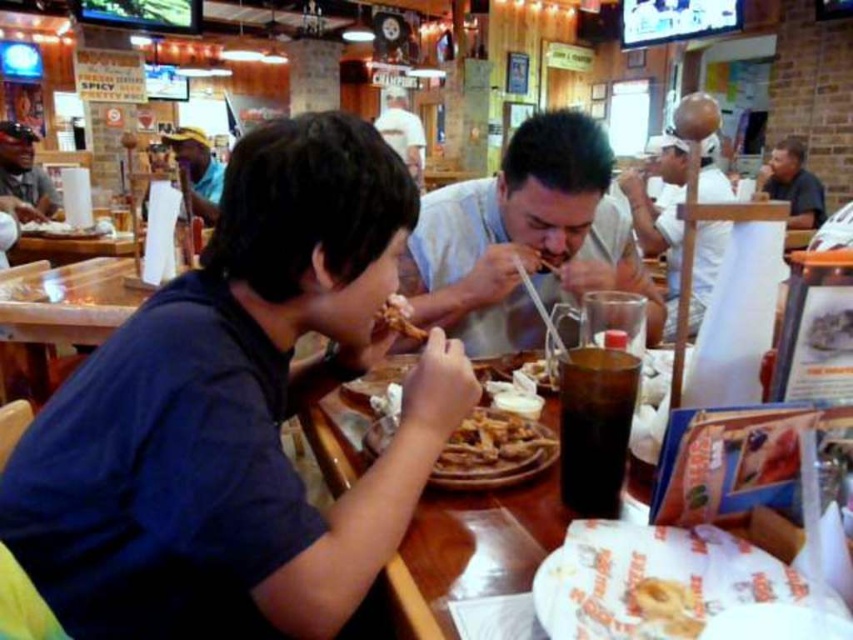
You are a photographer trying to capture a closeup shot of the blue denim shirt at upper left and the white paper hat at upper center. Which object should you zoom in on first to ensure both fit in the frame?

The blue denim shirt at upper left is wider than the white paper hat at upper center, so you should zoom in on the blue denim shirt at upper left first to ensure both fit in the frame.

You are sitting at the table in the image and want to hand the white paper hat at upper center to the person wearing the blue denim shirt at upper left. Can you directly hand it to them without moving your position?

Yes, because the blue denim shirt at upper left is closer to the viewer than the white paper hat at upper center, meaning the person is near the front of the table and can reach the hat easily.